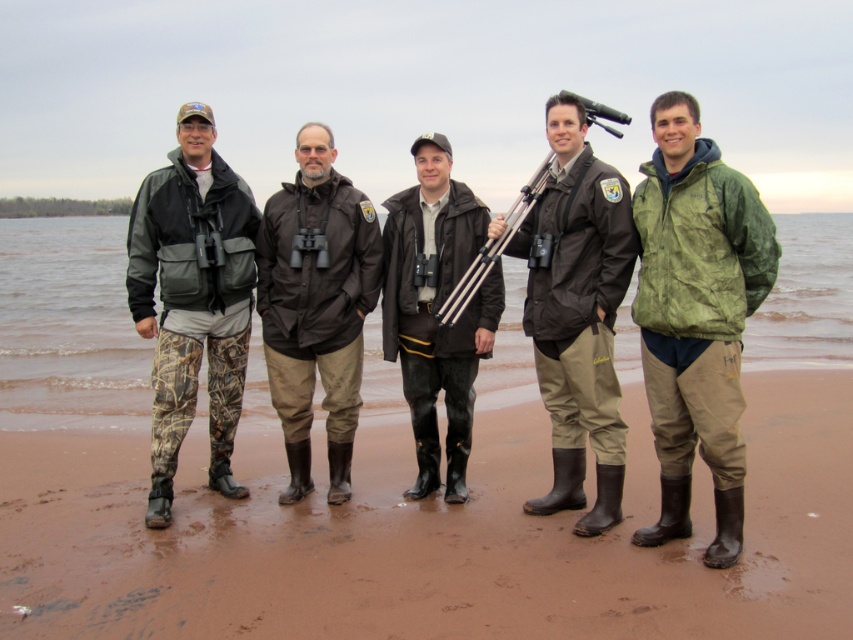
Does green matte jacket at center come behind matte black tripod at center?

No.

Who is lower down, green matte jacket at center or matte black tripod at center?

Positioned lower is green matte jacket at center.

Which is in front, point (657, 221) or point (434, 269)?

Point (657, 221) is more forward.

At what (x,y) coordinates should I click in order to perform the action: click on green matte jacket at center. Please return your answer as a coordinate pair (x, y). The image size is (853, 640). Looking at the image, I should click on click(x=695, y=316).

In the scene shown: Is brown rubber boots at lower center bigger than green matte jacket at center?

No, brown rubber boots at lower center is not bigger than green matte jacket at center.

In the scene shown: Who is positioned more to the right, brown rubber boots at lower center or green matte jacket at center?

green matte jacket at center is more to the right.

Identify the location of brown rubber boots at lower center. This screenshot has width=853, height=640. (430, 538).

The width and height of the screenshot is (853, 640). I want to click on brown rubber boots at lower center, so click(x=430, y=538).

The height and width of the screenshot is (640, 853). In order to click on camo pants at left in this screenshot , I will do `click(192, 298)`.

Does point (218, 362) come farther from viewer compared to point (311, 419)?

No, it is not.

You are a GUI agent. You are given a task and a screenshot of the screen. Output one action in this format:
    pyautogui.click(x=<x>, y=<y>)
    Task: Click on the camo pants at left
    This screenshot has width=853, height=640.
    Given the screenshot: What is the action you would take?
    pyautogui.click(x=192, y=298)